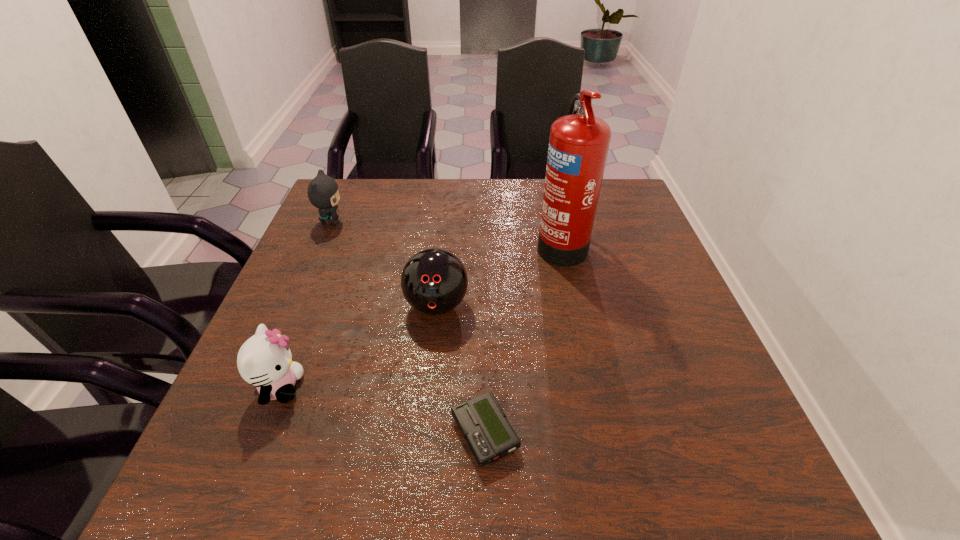
Identify the location of the tallest object. This screenshot has height=540, width=960. (578, 146).

Image resolution: width=960 pixels, height=540 pixels. I want to click on the rightmost object, so click(x=578, y=146).

The width and height of the screenshot is (960, 540). Identify the location of bowling ball. (434, 281).

In order to click on the farther kitten in this screenshot , I will do `click(323, 192)`.

Locate an element on the screen. Image resolution: width=960 pixels, height=540 pixels. the nearer kitten is located at coordinates (264, 360).

The image size is (960, 540). Find the location of `the shortest object`. the shortest object is located at coordinates (482, 422).

The width and height of the screenshot is (960, 540). I want to click on vacant space located on the surface of the fire extinguisher, so click(x=491, y=243).

You are a GUI agent. You are given a task and a screenshot of the screen. Output one action in this format:
    pyautogui.click(x=<x>, y=<y>)
    Task: Click on the vacant point located on the surface of the fire extinguisher
    The image size is (960, 540).
    Given the screenshot: What is the action you would take?
    pyautogui.click(x=431, y=243)

At what (x,y) coordinates should I click in order to perform the action: click on blank space located 0.240m on the surface of the fire extinguisher. Please return your answer as a coordinate pair (x, y). The width and height of the screenshot is (960, 540). Looking at the image, I should click on (445, 243).

Image resolution: width=960 pixels, height=540 pixels. In order to click on vacant space situated on the surface of the bowling ball near the finger holes in this screenshot , I will do `click(420, 467)`.